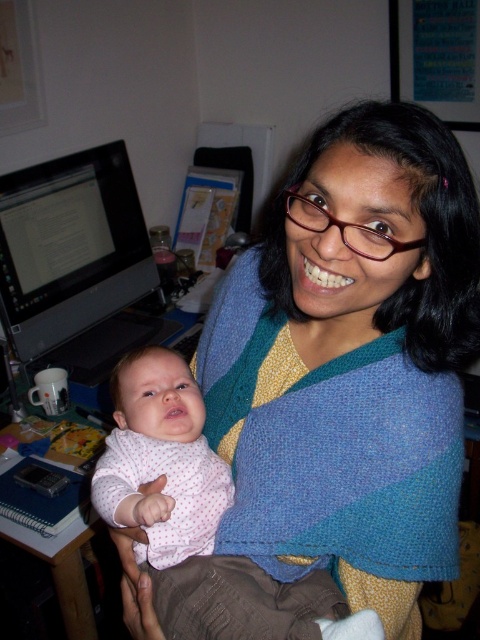
Question: Which object is positioned farthest from the pink dotted fabric at center?

Choices:
 (A) blue knitted shawl at center
 (B) matte black monitor at left

Answer: (B)

Question: Is blue knitted shawl at center behind pink dotted fabric at center?

Choices:
 (A) no
 (B) yes

Answer: (A)

Question: Does blue knitted shawl at center appear on the left side of matte black monitor at left?

Choices:
 (A) yes
 (B) no

Answer: (B)

Question: Considering the real-world distances, which object is closest to the blue knitted shawl at center?

Choices:
 (A) matte black monitor at left
 (B) pink dotted fabric at center

Answer: (B)

Question: Which of the following is the farthest from the observer?

Choices:
 (A) (448, 522)
 (B) (188, 572)

Answer: (B)

Question: Can you confirm if pink dotted fabric at center is positioned below matte black monitor at left?

Choices:
 (A) yes
 (B) no

Answer: (A)